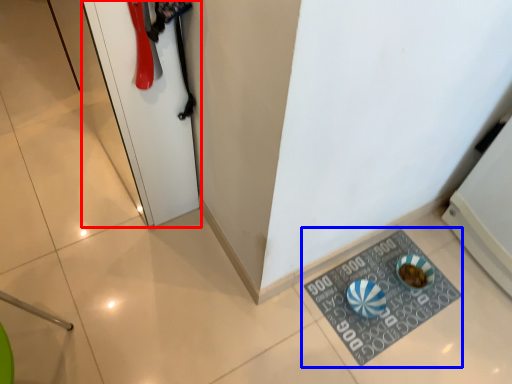
Question: Which point is further to the camera, door (highlighted by a red box) or doormat (highlighted by a blue box)?

Choices:
 (A) door
 (B) doormat

Answer: (B)